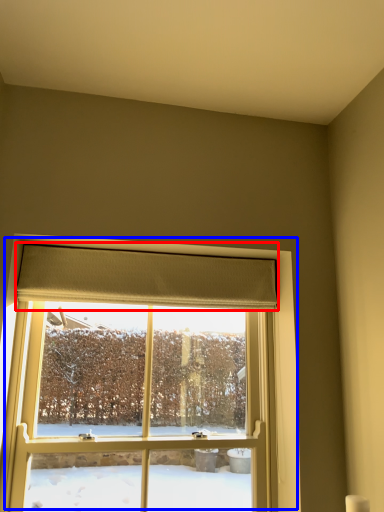
Question: Among these objects, which one is nearest to the camera, curtain (highlighted by a red box) or window (highlighted by a blue box)?

Choices:
 (A) curtain
 (B) window

Answer: (B)